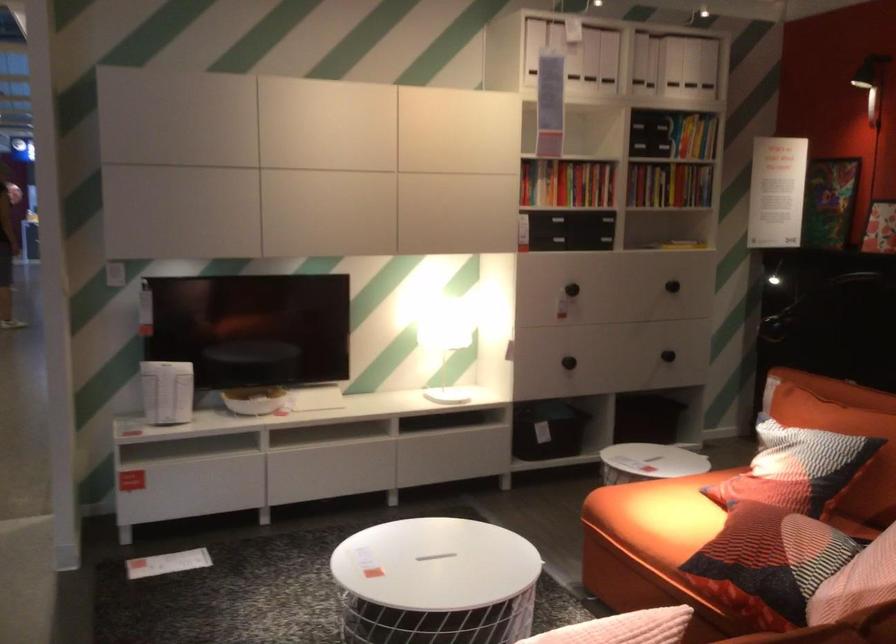
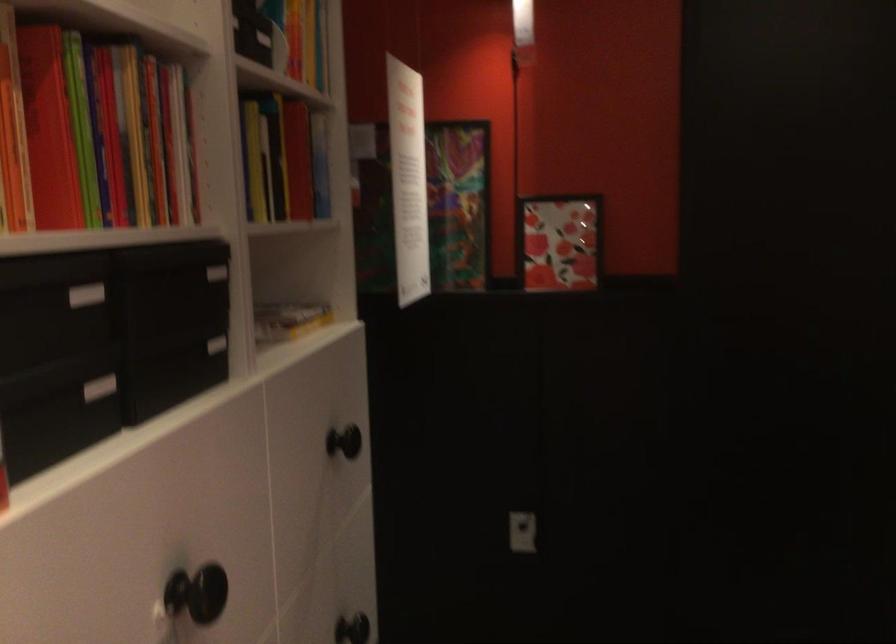
In the second image, find the point that corresponds to pixel 586 267 in the first image.

(196, 592)